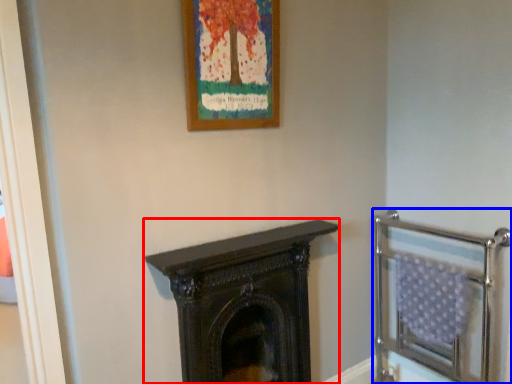
Question: Among these objects, which one is farthest to the camera, fireplace (highlighted by a red box) or balustrade (highlighted by a blue box)?

Choices:
 (A) fireplace
 (B) balustrade

Answer: (B)